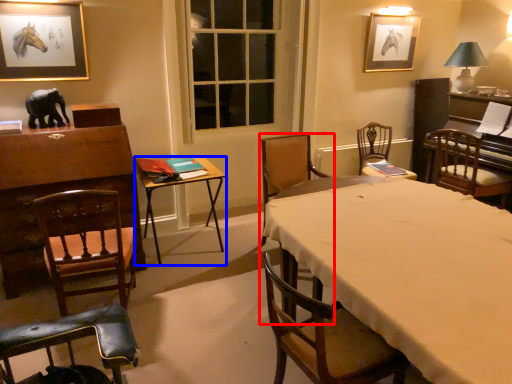
Question: Which object appears farthest to the camera in this image, chair (highlighted by a red box) or table (highlighted by a blue box)?

Choices:
 (A) chair
 (B) table

Answer: (B)